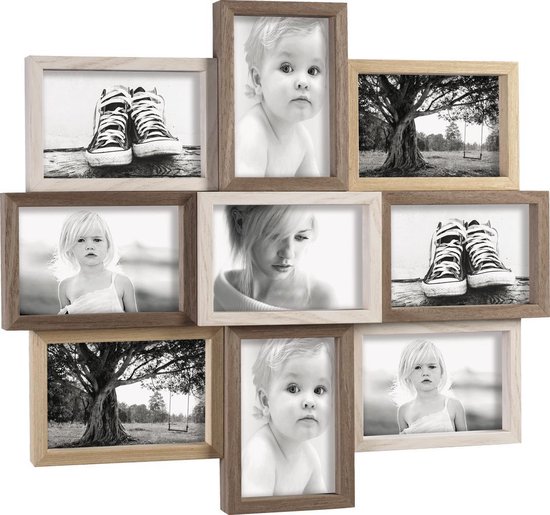
This screenshot has height=515, width=550. I want to click on frames, so click(x=419, y=327), click(x=293, y=328), click(x=112, y=343), click(x=108, y=319), click(x=257, y=316), click(x=462, y=311), click(x=420, y=186), click(x=283, y=185), click(x=136, y=187).